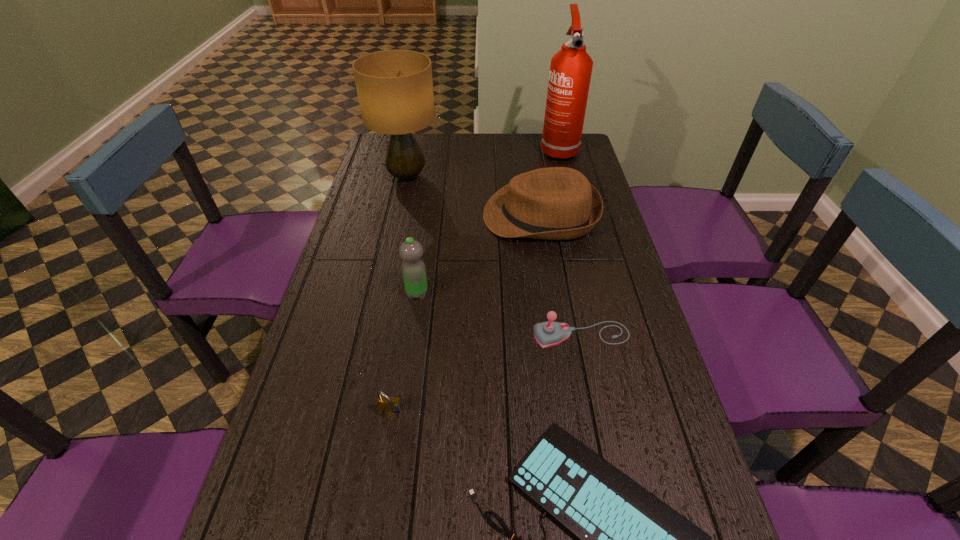
You are a GUI agent. You are given a task and a screenshot of the screen. Output one action in this format:
    pyautogui.click(x=<x>, y=<y>)
    Task: Click on the fire extinguisher
    The width and height of the screenshot is (960, 540).
    Given the screenshot: What is the action you would take?
    pyautogui.click(x=570, y=73)

Image resolution: width=960 pixels, height=540 pixels. What are the coordinates of `lampshade` in the screenshot? It's located at (395, 88).

The height and width of the screenshot is (540, 960). Find the location of `water bottle`. water bottle is located at coordinates (413, 269).

Where is `the fifth shortest object`? The height and width of the screenshot is (540, 960). the fifth shortest object is located at coordinates [x=413, y=269].

You are a GUI agent. You are given a task and a screenshot of the screen. Output one action in this format:
    pyautogui.click(x=<x>, y=<y>)
    Task: Click on the fourth tallest object
    The height and width of the screenshot is (540, 960).
    Given the screenshot: What is the action you would take?
    pyautogui.click(x=556, y=203)

In order to click on the fifth farthest object in this screenshot , I will do `click(549, 333)`.

At what (x,y) coordinates should I click in order to perform the action: click on the sixth farthest object. Please return your answer as a coordinate pair (x, y). This screenshot has width=960, height=540. Looking at the image, I should click on (386, 403).

Locate an element on the screen. vacant area located 0.370m at the nozzle of the fire extinguisher is located at coordinates (576, 220).

I want to click on free space located on the back of the lampshade, so click(x=414, y=145).

The image size is (960, 540). What are the coordinates of `free region located 0.400m on the right of the fourth farthest object` in the screenshot? It's located at (569, 294).